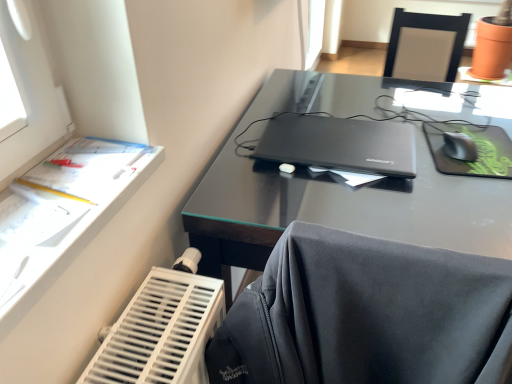
Locate an element on the screen. Image resolution: width=512 pixels, height=384 pixels. free location to the left of black matte mouse pad at right is located at coordinates (417, 157).